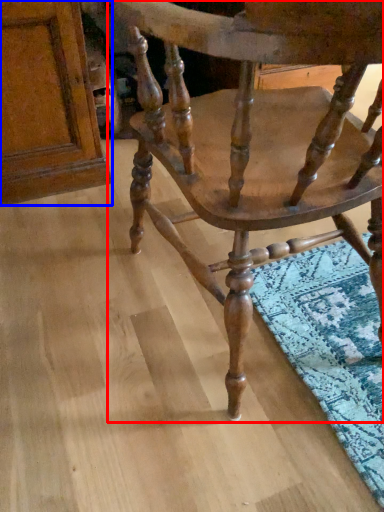
Question: Among these objects, which one is farthest to the camera, chair (highlighted by a red box) or plank (highlighted by a blue box)?

Choices:
 (A) chair
 (B) plank

Answer: (B)